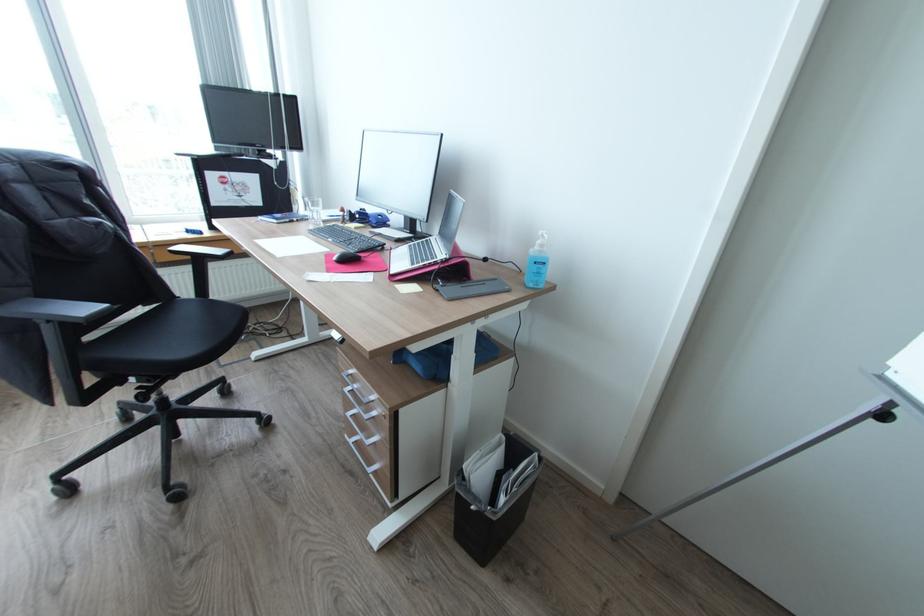
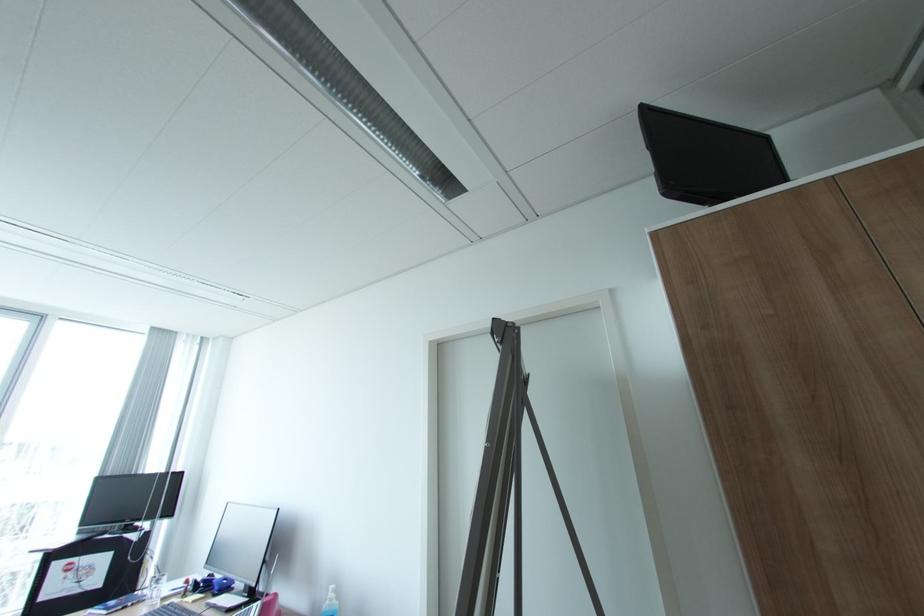
Find the pixel in the second image that matches point (380, 221) in the first image.

(222, 588)